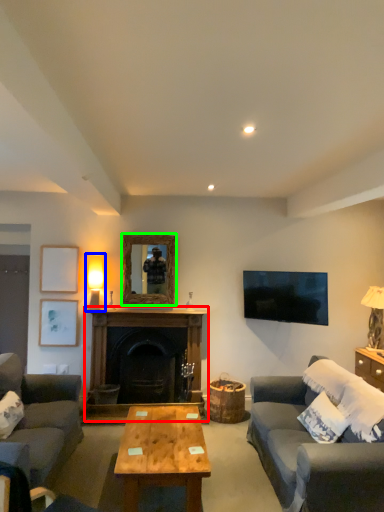
Question: Which object is positioned farthest from fireplace (highlighted by a red box)? Select from table lamp (highlighted by a blue box) and mirror (highlighted by a green box).

Choices:
 (A) table lamp
 (B) mirror

Answer: (A)